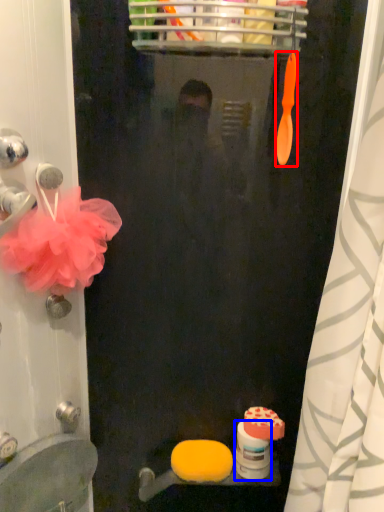
Question: Which object is further to the camera taking this photo, brush (highlighted by a red box) or toilet paper (highlighted by a blue box)?

Choices:
 (A) brush
 (B) toilet paper

Answer: (B)